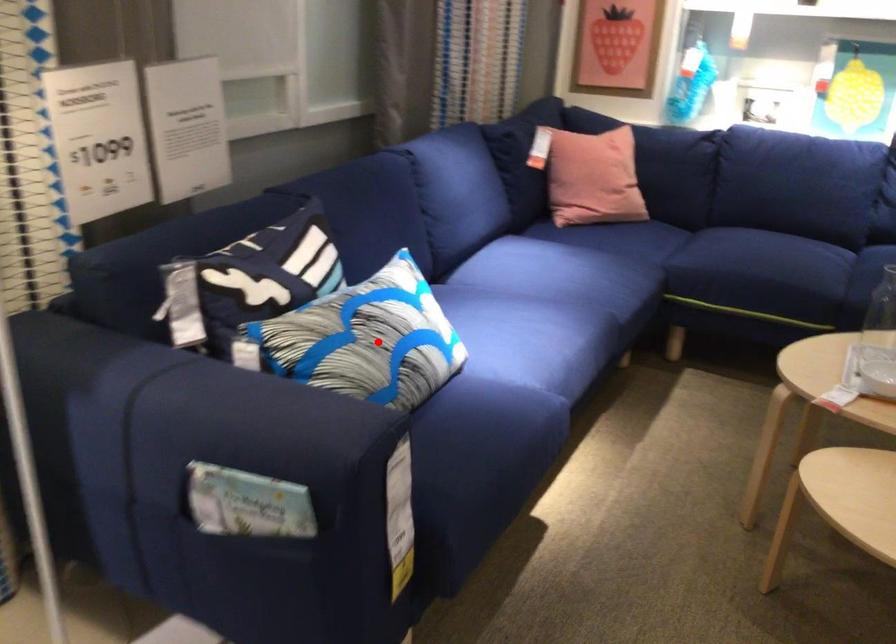
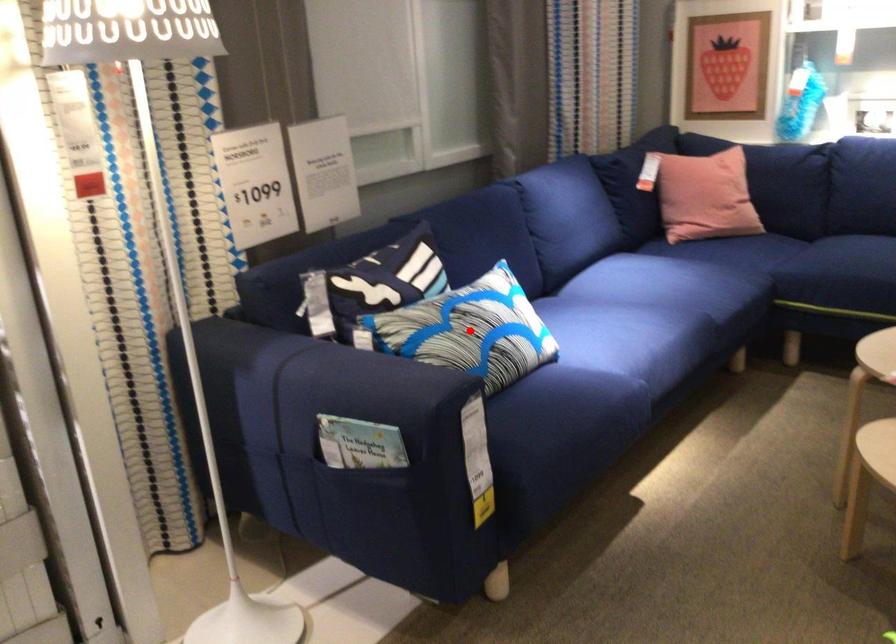
I am providing you with two images of the same scene from different viewpoints. A red point is marked on the first image and another point is marked on the second image. Are the points marked in image1 and image2 representing the same 3D position?

Yes